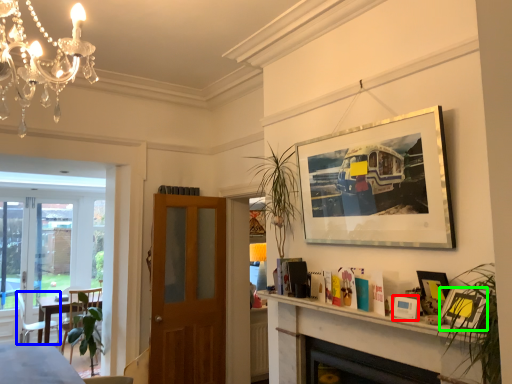
Question: Based on their relative distances, which object is nearer to picture frame (highlighted by a red box)? Choose from chair (highlighted by a blue box) and picture frame (highlighted by a green box).

Choices:
 (A) chair
 (B) picture frame

Answer: (B)